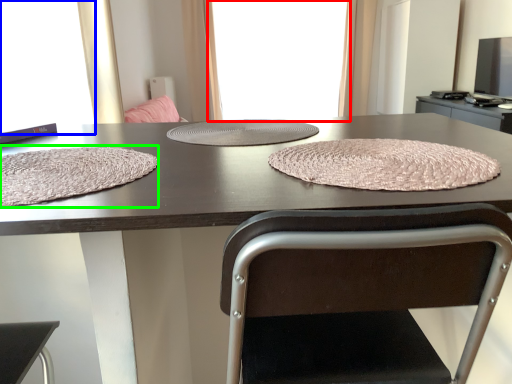
Question: Which is nearer to the window screen (highlighted by a red box)? window screen (highlighted by a blue box) or blanket (highlighted by a green box).

Choices:
 (A) window screen
 (B) blanket

Answer: (A)